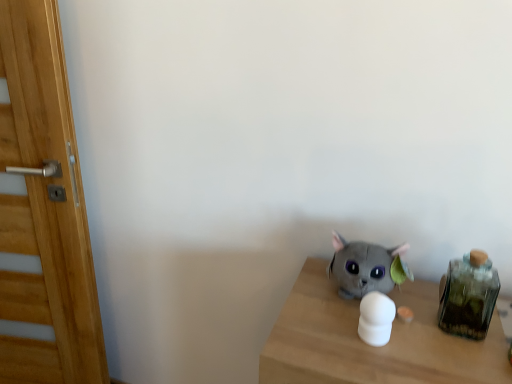
Image resolution: width=512 pixels, height=384 pixels. Describe the element at coordinates (42, 209) in the screenshot. I see `wooden door at left` at that location.

Measure the distance between white matte object at center, the second toy viewed from the back, and camera.

white matte object at center, the second toy viewed from the back, is 91.58 centimeters from camera.

Identify the location of white matte object at center, the second toy viewed from the back. Image resolution: width=512 pixels, height=384 pixels. (376, 318).

You are a GUI agent. You are given a task and a screenshot of the screen. Output one action in this format:
    pyautogui.click(x=<x>, y=<y>)
    Task: Click on the wooden door at left
    Image resolution: width=512 pixels, height=384 pixels.
    Given the screenshot: What is the action you would take?
    pyautogui.click(x=42, y=209)

Does point (361, 278) lie behind point (389, 311)?

Yes, point (361, 278) is farther from viewer.

Based on their sizes in the image, would you say soft gray plush cat at center, arranged as the 2th toy when viewed from the front, is bigger or smaller than white matte object at center, which is counted as the first toy, starting from the front?

Clearly, soft gray plush cat at center, arranged as the 2th toy when viewed from the front, is larger in size than white matte object at center, which is counted as the first toy, starting from the front.

Which of these two, soft gray plush cat at center, which is counted as the 1th toy, starting from the back, or white matte object at center, which is counted as the first toy, starting from the front, stands taller?

With more height is soft gray plush cat at center, which is counted as the 1th toy, starting from the back.

Which object is closer to the camera, soft gray plush cat at center, which is counted as the 1th toy, starting from the back, or green glass jar at right?

green glass jar at right is more forward.

Which of these two, soft gray plush cat at center, arranged as the 2th toy when viewed from the front, or green glass jar at right, is smaller?

green glass jar at right is smaller.

Consider the image. Which object is wider, soft gray plush cat at center, arranged as the 2th toy when viewed from the front, or green glass jar at right?

soft gray plush cat at center, arranged as the 2th toy when viewed from the front, is wider.

Locate an element on the screen. toy behind the green glass jar at right is located at coordinates (365, 267).

Looking at their sizes, would you say white matte object at center, the second toy viewed from the back, is wider or thinner than green glass jar at right?

Considering their sizes, white matte object at center, the second toy viewed from the back, looks slimmer than green glass jar at right.

Is white matte object at center, which is counted as the first toy, starting from the front, next to green glass jar at right and touching it?

No, white matte object at center, which is counted as the first toy, starting from the front, is not in contact with green glass jar at right.

How distant is white matte object at center, the second toy viewed from the back, from green glass jar at right?

The distance of white matte object at center, the second toy viewed from the back, from green glass jar at right is 19.04 centimeters.

From the picture: Who is shorter, white matte object at center, which is counted as the first toy, starting from the front, or green glass jar at right?

white matte object at center, which is counted as the first toy, starting from the front, is shorter.

Considering the sizes of objects green glass jar at right and white matte object at center, the second toy viewed from the back, in the image provided, who is shorter, green glass jar at right or white matte object at center, the second toy viewed from the back,?

Standing shorter between the two is white matte object at center, the second toy viewed from the back.

Is point (462, 262) behind point (369, 320)?

Yes, it is behind point (369, 320).

From a real-world perspective, is green glass jar at right located beneath white matte object at center, which is counted as the first toy, starting from the front?

No, from a real-world perspective, green glass jar at right is not under white matte object at center, which is counted as the first toy, starting from the front.

Is wooden door at left not within soft gray plush cat at center, which is counted as the 1th toy, starting from the back?

Absolutely, wooden door at left is external to soft gray plush cat at center, which is counted as the 1th toy, starting from the back.

Are wooden door at left and soft gray plush cat at center, which is counted as the 1th toy, starting from the back, far apart?

wooden door at left is actually quite close to soft gray plush cat at center, which is counted as the 1th toy, starting from the back.

Is wooden door at left facing towards soft gray plush cat at center, arranged as the 2th toy when viewed from the front?

No, wooden door at left is not oriented towards soft gray plush cat at center, arranged as the 2th toy when viewed from the front.

Considering the sizes of wooden door at left and green glass jar at right in the image, is wooden door at left taller or shorter than green glass jar at right?

Considering their sizes, wooden door at left has more height than green glass jar at right.

In the scene shown: Is wooden door at left inside the boundaries of green glass jar at right, or outside?

wooden door at left is outside green glass jar at right.

From a real-world perspective, is wooden door at left above or below green glass jar at right?

From a real-world perspective, wooden door at left is physically below green glass jar at right.

Considering the sizes of objects wooden door at left and green glass jar at right in the image provided, who is smaller, wooden door at left or green glass jar at right?

green glass jar at right.

Is white matte object at center, which is counted as the first toy, starting from the front, surrounded by wooden door at left?

No, white matte object at center, which is counted as the first toy, starting from the front, is not surrounded by wooden door at left.

In terms of size, does wooden door at left appear bigger or smaller than white matte object at center, the second toy viewed from the back?

Clearly, wooden door at left is larger in size than white matte object at center, the second toy viewed from the back.

From the image's perspective, which one is positioned higher, wooden door at left or white matte object at center, the second toy viewed from the back?

wooden door at left appears higher in the image.

From a real-world perspective, who is located higher, wooden door at left or white matte object at center, which is counted as the first toy, starting from the front?

From a 3D spatial view, white matte object at center, which is counted as the first toy, starting from the front, is above.

Find the location of a particular element. toy to the right of white matte object at center, the second toy viewed from the back is located at coordinates (365, 267).

Which toy is the 1st one when counting from the left side of the green glass jar at right? Please provide its 2D coordinates.

[(365, 267)]

Estimate the real-world distances between objects in this image. Which object is further from soft gray plush cat at center, which is counted as the 1th toy, starting from the back, green glass jar at right or wooden door at left?

Based on the image, wooden door at left appears to be further to soft gray plush cat at center, which is counted as the 1th toy, starting from the back.

Consider the image. Considering their positions, is wooden door at left positioned closer to green glass jar at right than white matte object at center, the second toy viewed from the back?

The object closer to green glass jar at right is white matte object at center, the second toy viewed from the back.

Looking at the image, which one is located further to green glass jar at right, white matte object at center, the second toy viewed from the back, or wooden door at left?

wooden door at left is positioned further to the anchor green glass jar at right.

Estimate the real-world distances between objects in this image. Which object is closer to white matte object at center, the second toy viewed from the back, soft gray plush cat at center, which is counted as the 1th toy, starting from the back, or wooden door at left?

Among the two, soft gray plush cat at center, which is counted as the 1th toy, starting from the back, is located nearer to white matte object at center, the second toy viewed from the back.

Looking at the image, which one is located further to soft gray plush cat at center, which is counted as the 1th toy, starting from the back, wooden door at left or white matte object at center, the second toy viewed from the back?

wooden door at left is further to soft gray plush cat at center, which is counted as the 1th toy, starting from the back.

When comparing their distances from wooden door at left, does soft gray plush cat at center, which is counted as the 1th toy, starting from the back, or green glass jar at right seem further?

green glass jar at right is positioned further to the anchor wooden door at left.

Based on the photo, considering their positions, is green glass jar at right positioned closer to white matte object at center, the second toy viewed from the back, than soft gray plush cat at center, which is counted as the 1th toy, starting from the back?

Based on the image, soft gray plush cat at center, which is counted as the 1th toy, starting from the back, appears to be nearer to white matte object at center, the second toy viewed from the back.

Considering their positions, is green glass jar at right positioned closer to white matte object at center, which is counted as the first toy, starting from the front, than wooden door at left?

Based on the image, green glass jar at right appears to be nearer to white matte object at center, which is counted as the first toy, starting from the front.

This screenshot has width=512, height=384. Identify the location of toy between wooden door at left and soft gray plush cat at center, which is counted as the 1th toy, starting from the back, in the horizontal direction. (376, 318).

I want to click on toy between white matte object at center, which is counted as the first toy, starting from the front, and green glass jar at right, in the horizontal direction, so click(x=365, y=267).